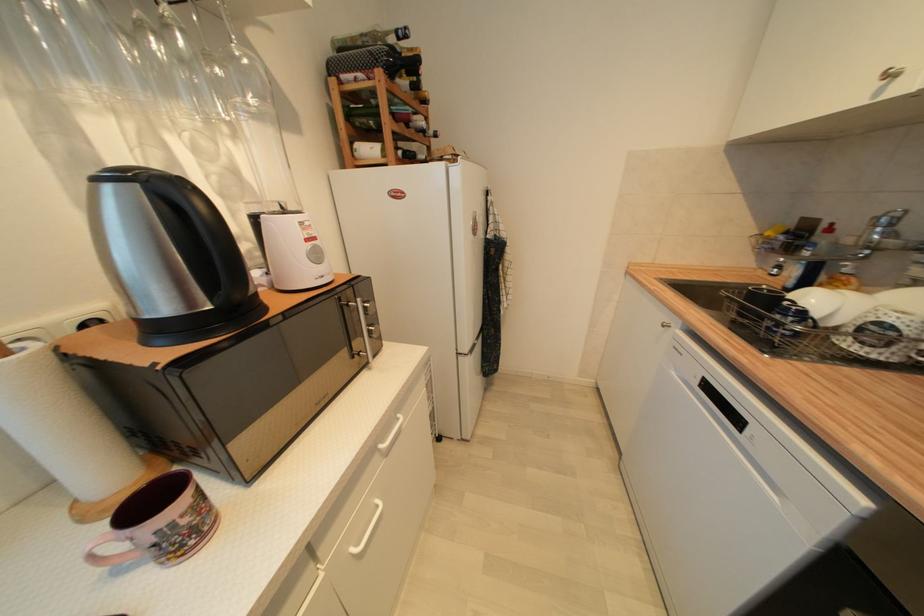
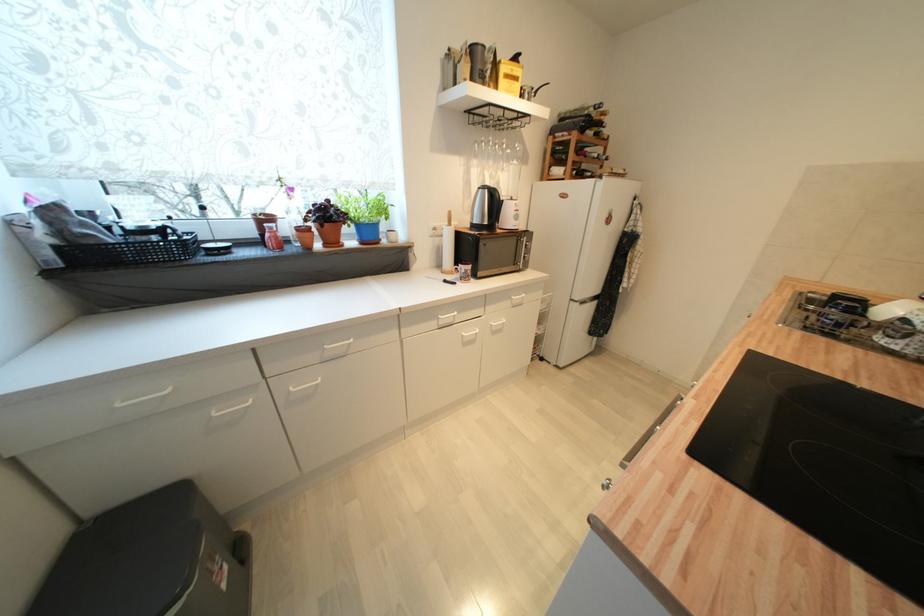
Locate, in the second image, the point that corresponds to the point at 127,177 in the first image.

(489, 188)